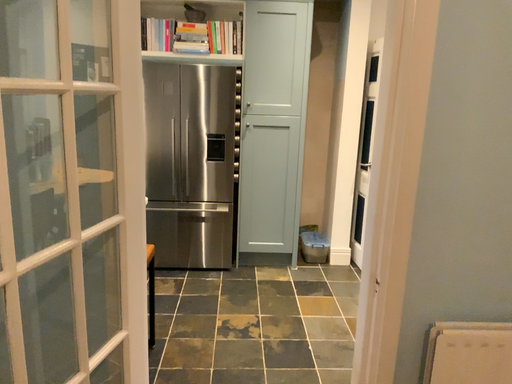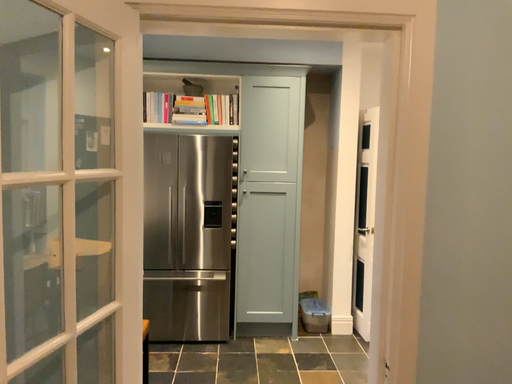
Question: How did the camera likely rotate when shooting the video?

Choices:
 (A) rotated downward
 (B) rotated upward

Answer: (B)